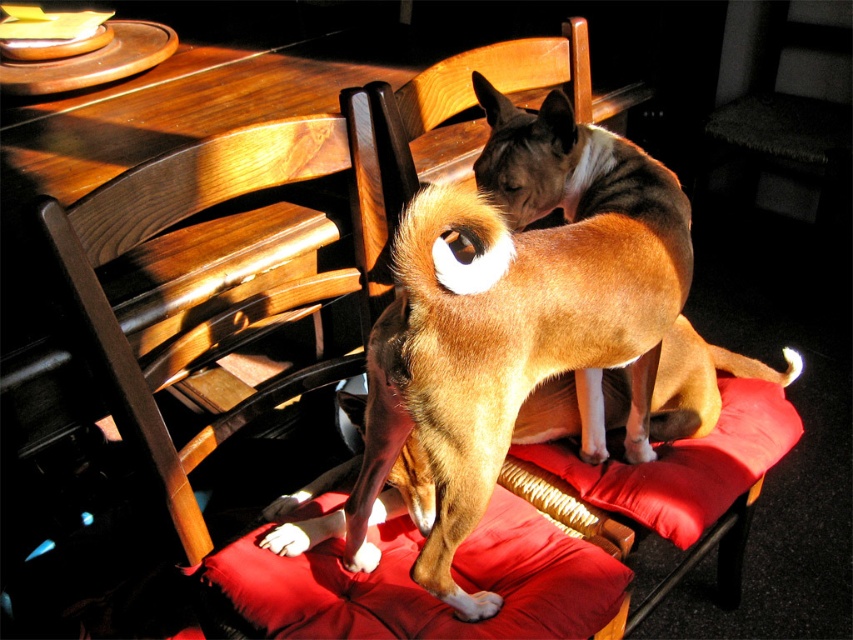
You are standing in the room and want to pet the brown fur dog at center. Based on its position, where should you approach from to reach it?

The brown fur dog at center is located at point [520,337], so you should approach from the front as it is positioned centrally in the scene.

You are a photographer setting up a shoot in this room. You need to place a small reflector to bounce light onto the brown fur dog at center without disturbing the velvet red cushion at center. Where should you position the reflector relative to the dog?

The brown fur dog at center is positioned over the velvet red cushion at center. To bounce light onto the dog without disturbing the cushion, place the reflector on the side opposite to the existing light source, facing the dog to reflect light onto it while keeping the cushion undisturbed.